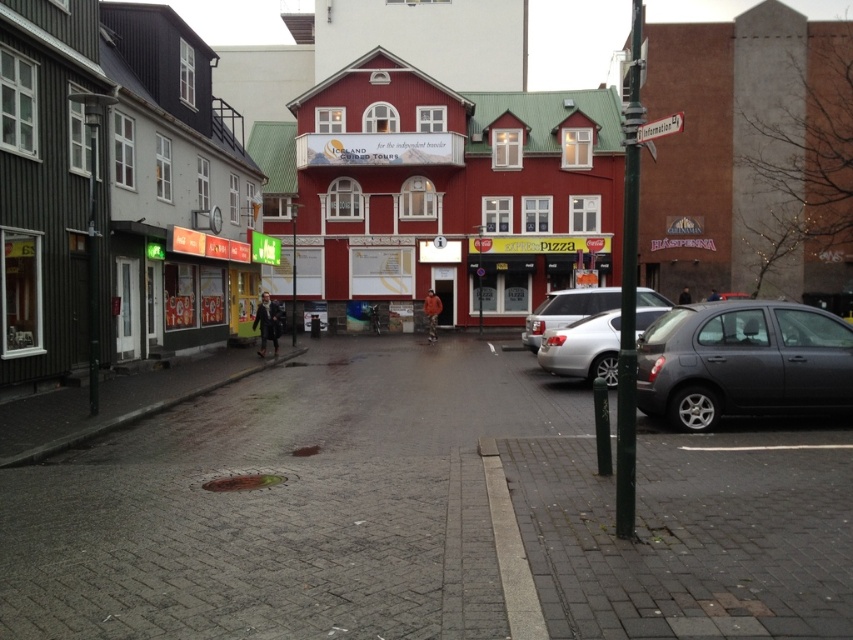
Between brick paved street at center and satin silver sedan at center, which one has less height?

satin silver sedan at center

Which is more to the right, brick paved street at center or satin silver sedan at center?

Positioned to the right is satin silver sedan at center.

The height and width of the screenshot is (640, 853). Identify the location of brick paved street at center. (306, 189).

How far apart are red painted building at center and green metallic pole at right?

red painted building at center and green metallic pole at right are 31.78 feet apart.

The width and height of the screenshot is (853, 640). What do you see at coordinates (456, 188) in the screenshot?
I see `red painted building at center` at bounding box center [456, 188].

The image size is (853, 640). What are the coordinates of `red painted building at center` in the screenshot? It's located at (456, 188).

Who is shorter, red painted building at center or silver metallic sedan at center?

With less height is silver metallic sedan at center.

Where is `red painted building at center`? The image size is (853, 640). red painted building at center is located at coordinates (456, 188).